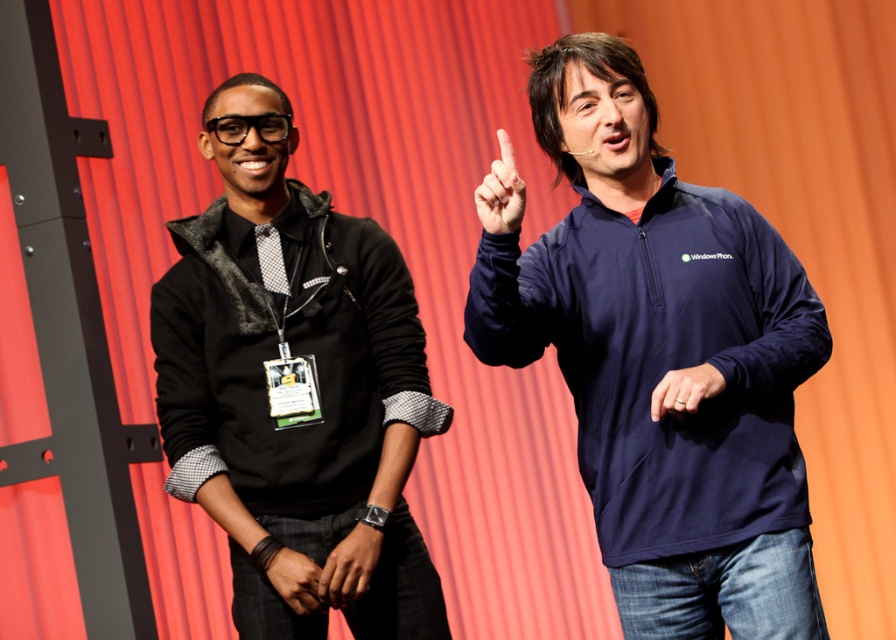
Question: Based on their relative distances, which object is farther from the matte black wristband at lower center?

Choices:
 (A) navy blue fleece at center
 (B) silver metallic ring at center
 (C) black fleece jacket at left
 (D) matte blue finger at center

Answer: (A)

Question: Is black fleece jacket at left to the left of silver metallic ring at center from the viewer's perspective?

Choices:
 (A) yes
 (B) no

Answer: (A)

Question: Which point is farther to the camera?

Choices:
 (A) silver metallic ring at center
 (B) matte blue finger at center
 (C) black fleece jacket at left
 (D) navy blue fleece at center

Answer: (C)

Question: Which object is closer to the camera taking this photo?

Choices:
 (A) matte black wristband at lower center
 (B) silver metallic ring at center
 (C) navy blue fleece at center

Answer: (C)

Question: Observing the image, what is the correct spatial positioning of black fleece jacket at left in reference to matte black wristband at lower center?

Choices:
 (A) right
 (B) left

Answer: (B)

Question: Where is silver metallic ring at center located in relation to matte black wristband at lower center in the image?

Choices:
 (A) above
 (B) below

Answer: (A)